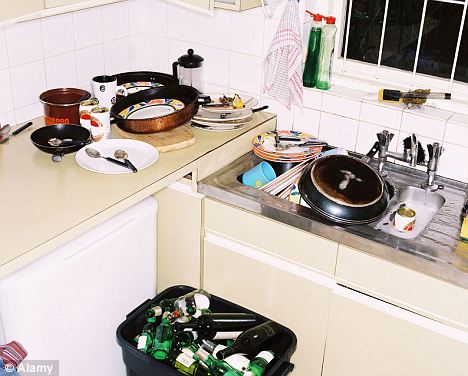
Find the location of a particular element. The width and height of the screenshot is (468, 376). dish soap is located at coordinates (307, 62), (320, 73).